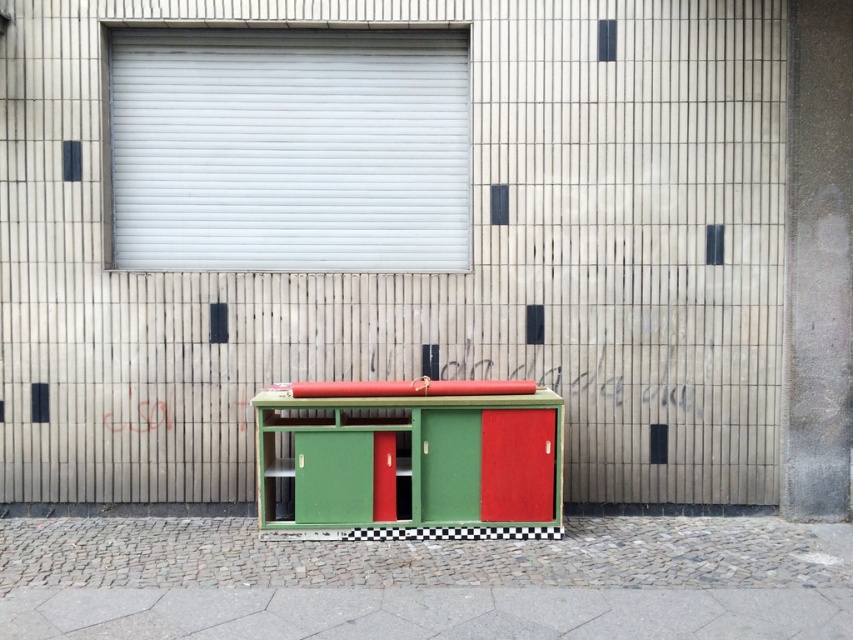
You are a delivery person trying to park your 1.2 meter wide cart in the area between the cobblestone pavement at lower center and the green matte cabinet at center. Can your cart fit there?

The cobblestone pavement at lower center is wider than the green matte cabinet at center, so the 1.2 meter wide cart can fit in the space between them.

You are a delivery person trying to place a package on the cobblestone pavement at lower center. However, there is a green matte cabinet at center in the way. Can you place the package on the pavement without moving the cabinet?

The cobblestone pavement at lower center is shorter than the green matte cabinet at center, meaning the cabinet is taller. Since the cabinet is taller, it may block access to the pavement, making it difficult to place the package without moving the cabinet.